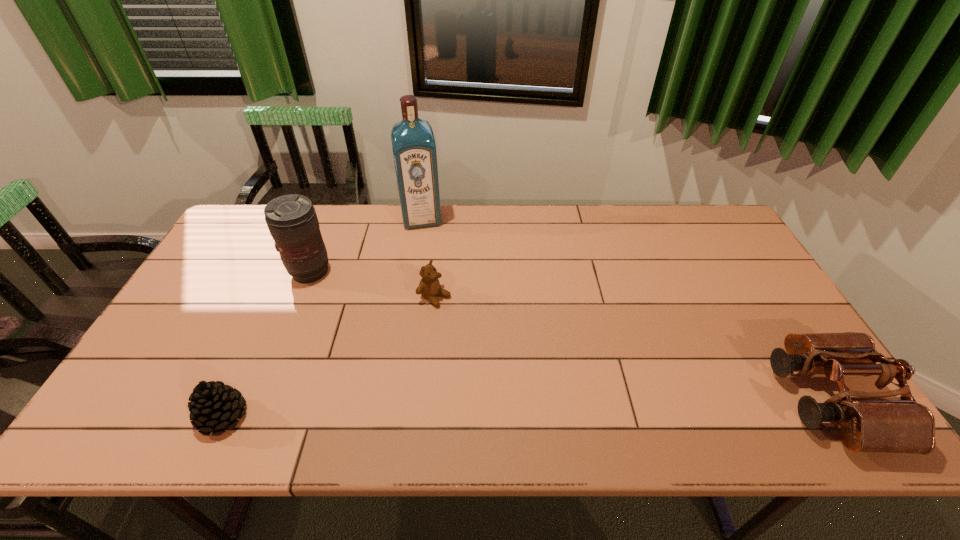
Choose which object is the third nearest neighbor to the fourth shortest object. Please provide its 2D coordinates. Your answer should be formatted as a tuple, i.e. [(x, y)], where the tuple contains the x and y coordinates of a point satisfying the conditions above.

[(214, 406)]

Where is `free region that satisfies the following two spatial constraints: 1. on the front side of the liquor; 2. through the eyepieces of the rightmost object`? free region that satisfies the following two spatial constraints: 1. on the front side of the liquor; 2. through the eyepieces of the rightmost object is located at coordinates tap(393, 401).

I want to click on vacant position in the image that satisfies the following two spatial constraints: 1. on the front side of the teddy bear; 2. on the right side of the farthest object, so click(409, 296).